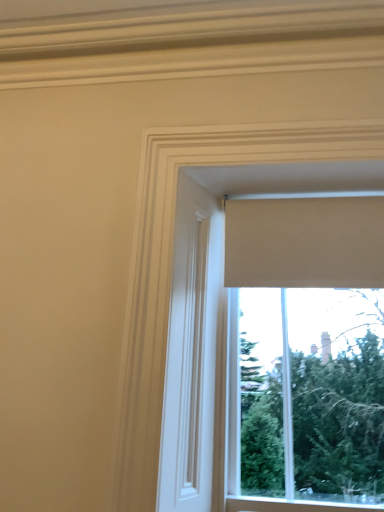
Question: From the image's perspective, is beige fabric curtain at upper center on beige fabric window at upper center?

Choices:
 (A) no
 (B) yes

Answer: (B)

Question: Considering the relative sizes of beige fabric curtain at upper center and beige fabric window at upper center in the image provided, is beige fabric curtain at upper center bigger than beige fabric window at upper center?

Choices:
 (A) no
 (B) yes

Answer: (A)

Question: Is beige fabric curtain at upper center thinner than beige fabric window at upper center?

Choices:
 (A) yes
 (B) no

Answer: (A)

Question: Is beige fabric curtain at upper center positioned with its back to beige fabric window at upper center?

Choices:
 (A) yes
 (B) no

Answer: (B)

Question: Considering the relative sizes of beige fabric curtain at upper center and beige fabric window at upper center in the image provided, is beige fabric curtain at upper center smaller than beige fabric window at upper center?

Choices:
 (A) yes
 (B) no

Answer: (A)

Question: Does beige fabric curtain at upper center lie behind beige fabric window at upper center?

Choices:
 (A) yes
 (B) no

Answer: (A)

Question: From a real-world perspective, is beige fabric window at upper center positioned under beige fabric curtain at upper center based on gravity?

Choices:
 (A) yes
 (B) no

Answer: (A)

Question: Is beige fabric window at upper center thinner than beige fabric curtain at upper center?

Choices:
 (A) yes
 (B) no

Answer: (B)

Question: From the image's perspective, is beige fabric window at upper center under beige fabric curtain at upper center?

Choices:
 (A) no
 (B) yes

Answer: (B)

Question: Can you confirm if beige fabric window at upper center is wider than beige fabric curtain at upper center?

Choices:
 (A) no
 (B) yes

Answer: (B)

Question: Does beige fabric window at upper center have a lesser height compared to beige fabric curtain at upper center?

Choices:
 (A) yes
 (B) no

Answer: (B)

Question: Does beige fabric window at upper center have a smaller size compared to beige fabric curtain at upper center?

Choices:
 (A) no
 (B) yes

Answer: (A)

Question: From a real-world perspective, relative to beige fabric window at upper center, is beige fabric curtain at upper center vertically above or below?

Choices:
 (A) above
 (B) below

Answer: (A)